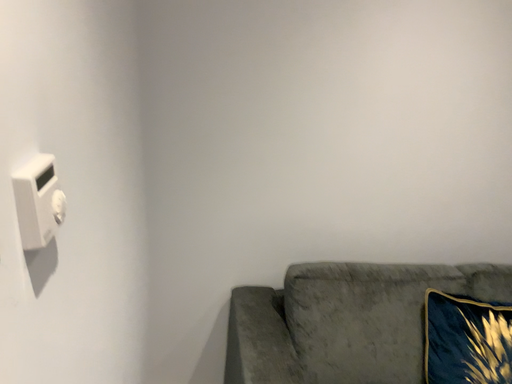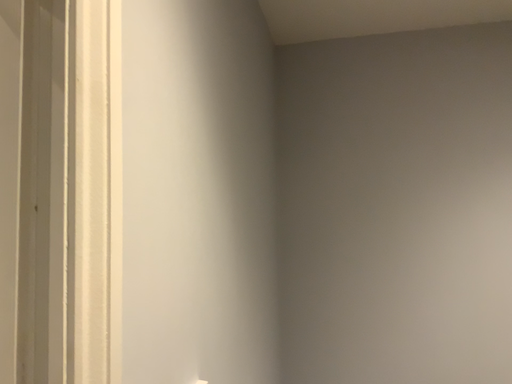
Question: Which way did the camera rotate in the video?

Choices:
 (A) rotated upward
 (B) rotated downward

Answer: (A)